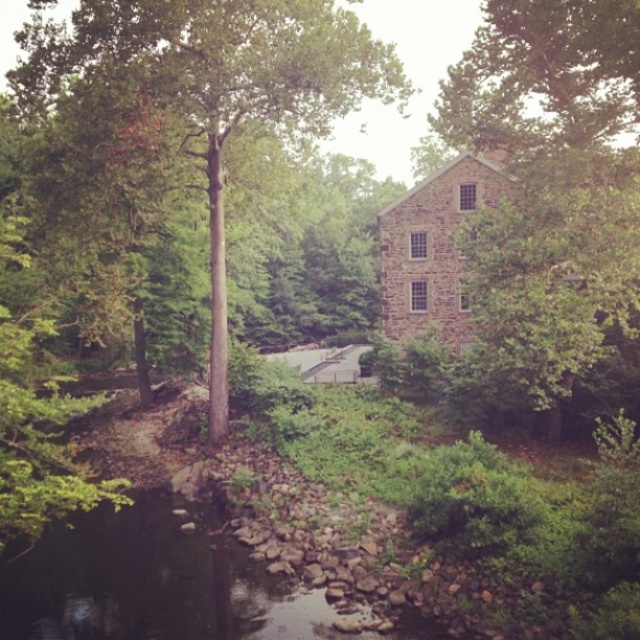
You are standing at the center of the stone building. Looking towards the green leafy tree at upper right, in which general direction should you walk to reach it?

The green leafy tree at upper right is located at coordinates point (561, 125), which is in the upper right direction from your current position at the center of the stone building. Therefore, you should walk towards the upper right direction to reach it.